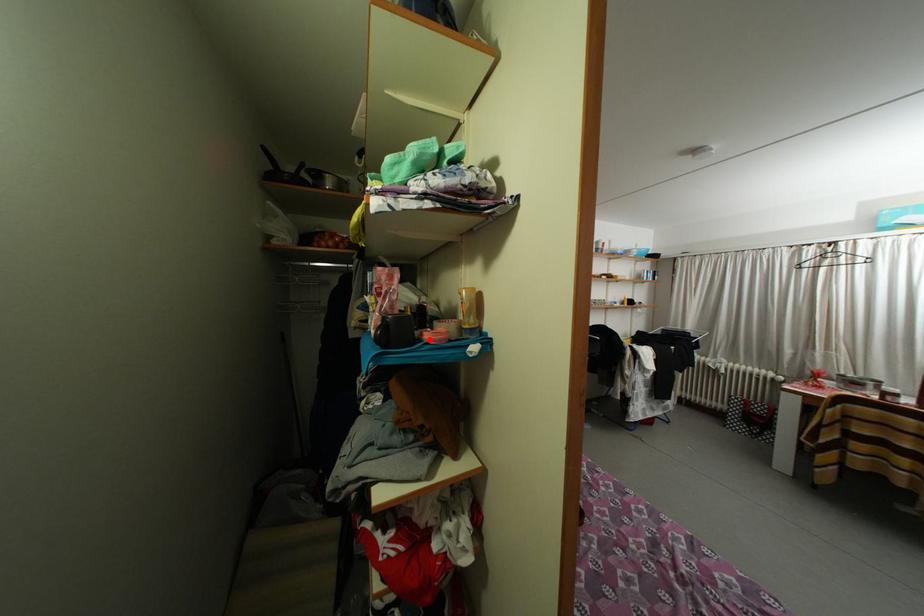
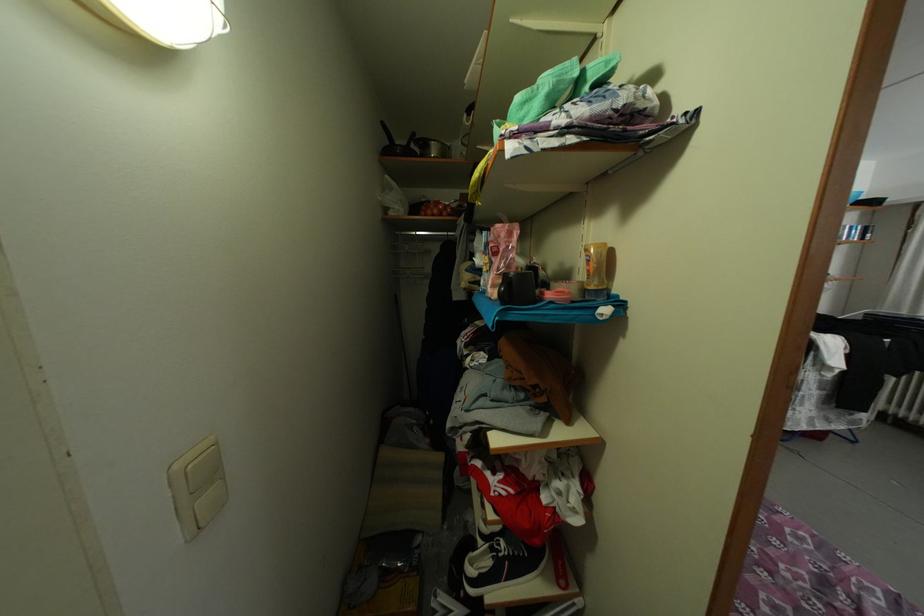
In the second image, find the point that corresponds to the highlighted location in the first image.

(551, 299)